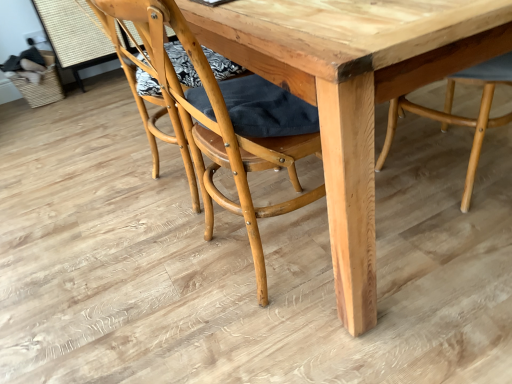
Locate an element on the screen. This screenshot has height=384, width=512. natural wood chair at center, positioned as the 2th chair in right-to-left order is located at coordinates (229, 123).

Is natural wood chair at center, the 2th chair in the left-to-right sequence, not inside natural wood chair at center, the first chair when ordered from left to right?

Yes, natural wood chair at center, the 2th chair in the left-to-right sequence, is located beyond the bounds of natural wood chair at center, the first chair when ordered from left to right.

Is natural wood chair at center, the 2th chair in the left-to-right sequence, positioned with its back to natural wood chair at center, positioned as the 2th chair in right-to-left order?

No, natural wood chair at center, positioned as the 2th chair in right-to-left order, is not at the back of natural wood chair at center, the 2th chair in the left-to-right sequence.

From a real-world perspective, is natural wood chair at center, which is counted as the first chair, starting from the right, physically located above or below natural wood chair at center, the first chair when ordered from left to right?

In terms of real-world spatial position, natural wood chair at center, which is counted as the first chair, starting from the right, is below natural wood chair at center, the first chair when ordered from left to right.

Considering the sizes of objects natural wood chair at center, which is counted as the first chair, starting from the right, and natural wood chair at center, positioned as the 2th chair in right-to-left order, in the image provided, who is thinner, natural wood chair at center, which is counted as the first chair, starting from the right, or natural wood chair at center, positioned as the 2th chair in right-to-left order,?

natural wood chair at center, positioned as the 2th chair in right-to-left order.

Can we say natural wood chair at center, positioned as the 2th chair in right-to-left order, lies outside natural wood chair at center, which is counted as the first chair, starting from the right?

natural wood chair at center, positioned as the 2th chair in right-to-left order, is positioned outside natural wood chair at center, which is counted as the first chair, starting from the right.

Which of these two, natural wood chair at center, the first chair when ordered from left to right, or natural wood chair at center, which is counted as the first chair, starting from the right, stands shorter?

With less height is natural wood chair at center, which is counted as the first chair, starting from the right.

Which point is more forward, (245, 110) or (458, 80)?

Positioned in front is point (245, 110).

Locate an element on the screen. Image resolution: width=512 pixels, height=384 pixels. chair behind the natural wood chair at center, positioned as the 2th chair in right-to-left order is located at coordinates (459, 116).

From the image's perspective, which object appears higher, natural wood table at center or natural wood chair at center, the first chair when ordered from left to right?

From the image's view, natural wood table at center is above.

Based on their sizes in the image, would you say natural wood table at center is bigger or smaller than natural wood chair at center, positioned as the 2th chair in right-to-left order?

natural wood table at center is bigger than natural wood chair at center, positioned as the 2th chair in right-to-left order.

Is there a large distance between natural wood table at center and natural wood chair at center, positioned as the 2th chair in right-to-left order?

Actually, natural wood table at center and natural wood chair at center, positioned as the 2th chair in right-to-left order, are a little close together.

Is natural wood chair at center, which is counted as the first chair, starting from the right, behind natural wood table at center?

Yes.

Is natural wood chair at center, which is counted as the first chair, starting from the right, facing towards natural wood table at center?

Yes, natural wood chair at center, which is counted as the first chair, starting from the right, is facing natural wood table at center.

Consider the image. From the image's perspective, is natural wood chair at center, the 2th chair in the left-to-right sequence, positioned above or below natural wood table at center?

natural wood chair at center, the 2th chair in the left-to-right sequence, is below natural wood table at center.

Are natural wood chair at center, which is counted as the first chair, starting from the right, and natural wood table at center located far from each other?

No, natural wood chair at center, which is counted as the first chair, starting from the right, is not far from natural wood table at center.

From the image's perspective, would you say natural wood table at center is shown under natural wood chair at center, the 2th chair in the left-to-right sequence?

No, from the image's perspective, natural wood table at center is not below natural wood chair at center, the 2th chair in the left-to-right sequence.

In the scene shown: From a real-world perspective, is natural wood table at center positioned over natural wood chair at center, which is counted as the first chair, starting from the right, based on gravity?

Yes.

Is natural wood table at center to the right of natural wood chair at center, the 2th chair in the left-to-right sequence, from the viewer's perspective?

In fact, natural wood table at center is to the left of natural wood chair at center, the 2th chair in the left-to-right sequence.

Does natural wood chair at center, positioned as the 2th chair in right-to-left order, have a larger size compared to natural wood table at center?

No.

Is natural wood chair at center, positioned as the 2th chair in right-to-left order, positioned with its back to natural wood table at center?

That's right, natural wood chair at center, positioned as the 2th chair in right-to-left order, is facing away from natural wood table at center.

Does natural wood chair at center, the first chair when ordered from left to right, have a greater height compared to natural wood table at center?

Indeed, natural wood chair at center, the first chair when ordered from left to right, has a greater height compared to natural wood table at center.

Is natural wood chair at center, positioned as the 2th chair in right-to-left order, to the left or to the right of natural wood table at center in the image?

natural wood chair at center, positioned as the 2th chair in right-to-left order, is to the left of natural wood table at center.

This screenshot has width=512, height=384. Identify the location of chair in front of the natural wood chair at center, which is counted as the first chair, starting from the right. (229, 123).

You are a GUI agent. You are given a task and a screenshot of the screen. Output one action in this format:
    pyautogui.click(x=<x>, y=<y>)
    Task: Click on the chair located underneath the natural wood chair at center, the first chair when ordered from left to right (from a real-world perspective)
    The height and width of the screenshot is (384, 512).
    Given the screenshot: What is the action you would take?
    pyautogui.click(x=459, y=116)

From the image, which object appears to be farther from natural wood table at center, natural wood chair at center, which is counted as the first chair, starting from the right, or natural wood chair at center, positioned as the 2th chair in right-to-left order?

natural wood chair at center, which is counted as the first chair, starting from the right, is positioned further to the anchor natural wood table at center.

Considering their positions, is natural wood chair at center, positioned as the 2th chair in right-to-left order, positioned further to natural wood chair at center, which is counted as the first chair, starting from the right, than natural wood table at center?

Among the two, natural wood chair at center, positioned as the 2th chair in right-to-left order, is located further to natural wood chair at center, which is counted as the first chair, starting from the right.

From the image, which object appears to be farther from natural wood chair at center, the first chair when ordered from left to right, natural wood table at center or natural wood chair at center, which is counted as the first chair, starting from the right?

The object further to natural wood chair at center, the first chair when ordered from left to right, is natural wood chair at center, which is counted as the first chair, starting from the right.

Considering their positions, is natural wood chair at center, the 2th chair in the left-to-right sequence, positioned closer to natural wood chair at center, the first chair when ordered from left to right, than natural wood table at center?

natural wood table at center is positioned closer to the anchor natural wood chair at center, the first chair when ordered from left to right.

From the image, which object appears to be nearer to natural wood chair at center, which is counted as the first chair, starting from the right, natural wood table at center or natural wood chair at center, positioned as the 2th chair in right-to-left order?

natural wood table at center lies closer to natural wood chair at center, which is counted as the first chair, starting from the right, than the other object.

Which object lies nearer to the anchor point natural wood table at center, natural wood chair at center, positioned as the 2th chair in right-to-left order, or natural wood chair at center, which is counted as the first chair, starting from the right?

Among the two, natural wood chair at center, positioned as the 2th chair in right-to-left order, is located nearer to natural wood table at center.

Image resolution: width=512 pixels, height=384 pixels. I want to click on round table situated between natural wood chair at center, positioned as the 2th chair in right-to-left order, and natural wood chair at center, the 2th chair in the left-to-right sequence, from left to right, so click(353, 91).